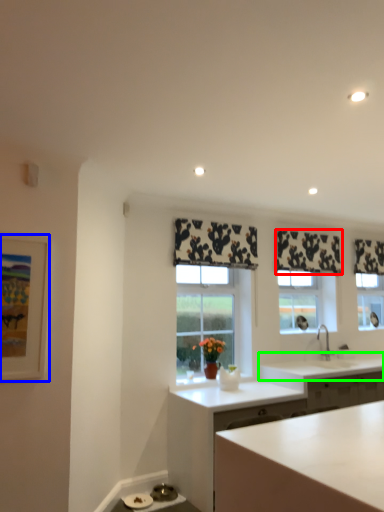
Question: Which object is positioned closest to curtain (highlighted by a red box)? Select from picture frame (highlighted by a blue box) and countertop (highlighted by a green box).

Choices:
 (A) picture frame
 (B) countertop

Answer: (B)